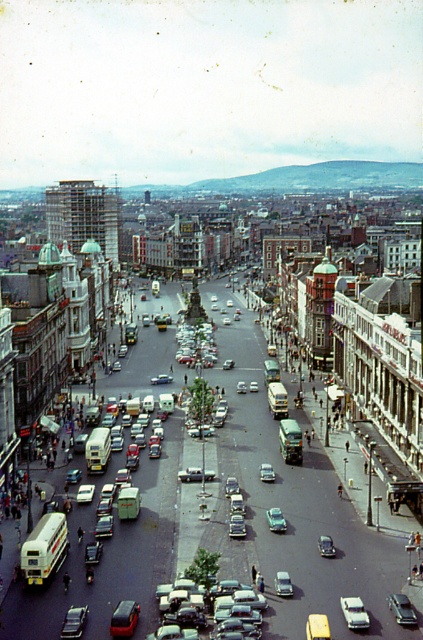
In the scene shown: Does metallic silver bus at center have a smaller size compared to metallic silver car at center?

Incorrect, metallic silver bus at center is not smaller in size than metallic silver car at center.

Is metallic silver bus at center below metallic silver car at center?

Actually, metallic silver bus at center is above metallic silver car at center.

Identify the location of metallic silver bus at center. (227, 529).

Who is lower down, metallic silver car at center or silver metallic sedan at center?

Positioned lower is silver metallic sedan at center.

Does metallic silver car at center appear under silver metallic sedan at center?

No, metallic silver car at center is not below silver metallic sedan at center.

Does point (238, 596) come behind point (354, 600)?

Yes, point (238, 596) is behind point (354, 600).

I want to click on metallic silver car at center, so click(x=244, y=609).

Does metallic silver bus at center have a greater width compared to silver metallic sedan at center?

Indeed, metallic silver bus at center has a greater width compared to silver metallic sedan at center.

Measure the distance between metallic silver bus at center and silver metallic sedan at center.

They are 169.01 feet apart.

You are a GUI agent. You are given a task and a screenshot of the screen. Output one action in this format:
    pyautogui.click(x=<x>, y=<y>)
    Task: Click on the metallic silver bus at center
    This screenshot has height=640, width=423.
    Given the screenshot: What is the action you would take?
    pyautogui.click(x=227, y=529)

The height and width of the screenshot is (640, 423). In order to click on metallic silver bus at center in this screenshot , I will do `click(227, 529)`.